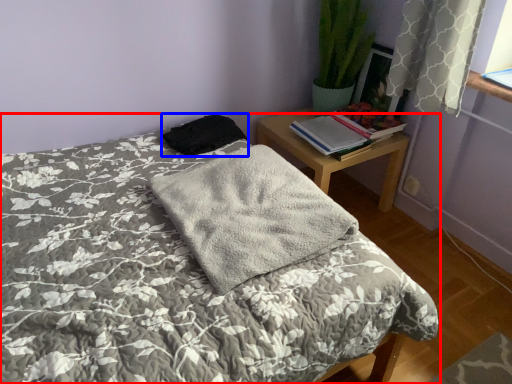
Question: Which point is closer to the camera, bed (highlighted by a red box) or material (highlighted by a blue box)?

Choices:
 (A) bed
 (B) material

Answer: (A)